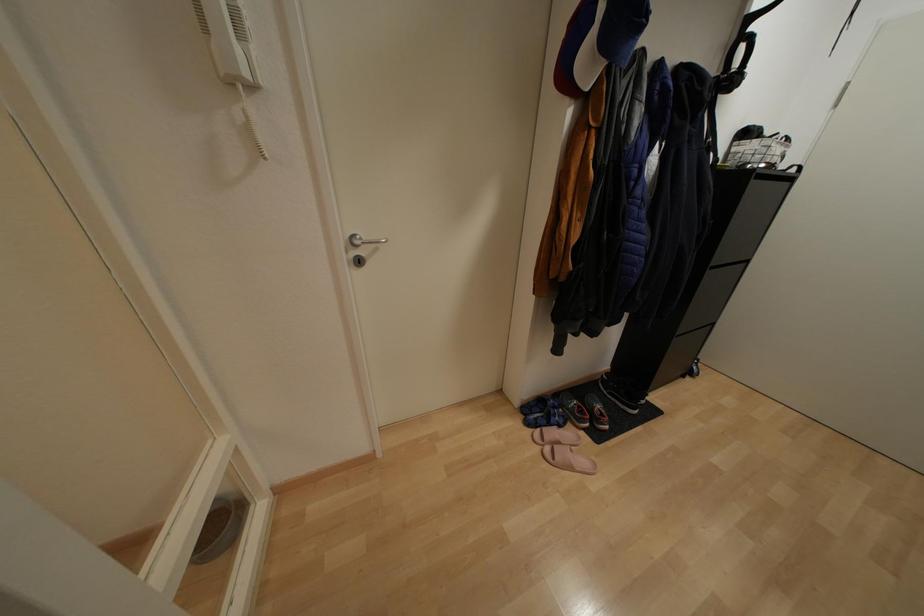
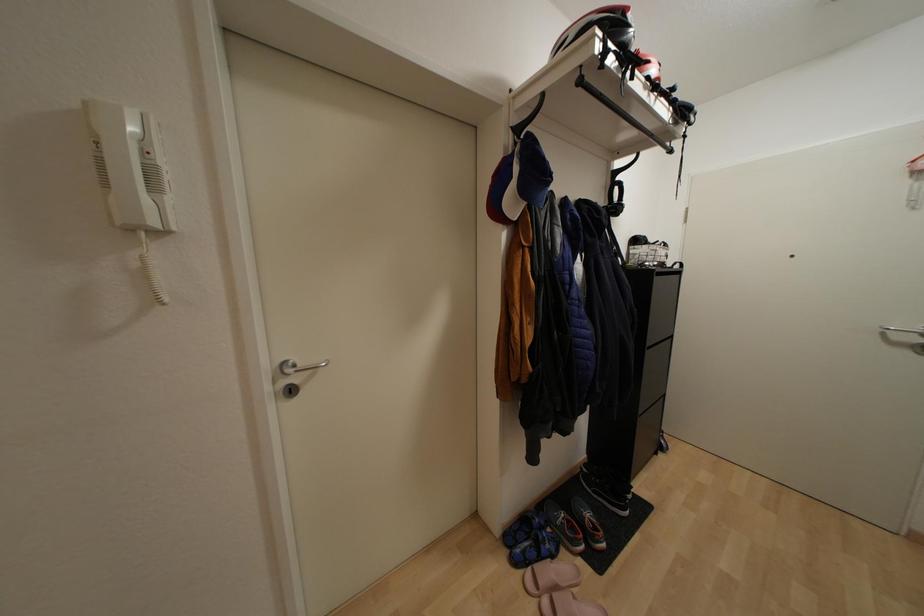
Question: The images are taken continuously from a first-person perspective. In which direction is your viewpoint rotating?

Choices:
 (A) Left
 (B) Right
 (C) Up
 (D) Down

Answer: (C)